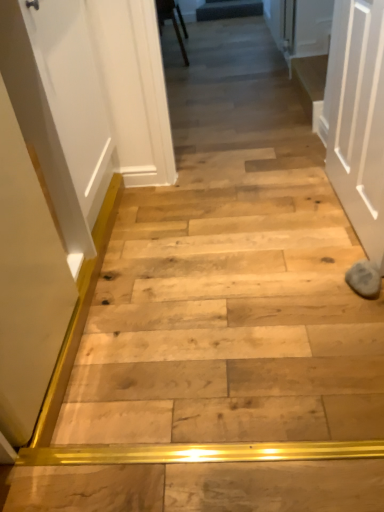
Question: Is point (236, 13) closer or farther from the camera than point (314, 111)?

Choices:
 (A) closer
 (B) farther

Answer: (B)

Question: From the image's perspective, is dark gray fabric at upper center, which is the second stairwell in front-to-back order, positioned above or below wooden step at center, which is the second stairwell in left-to-right order?

Choices:
 (A) below
 (B) above

Answer: (B)

Question: Estimate the real-world distances between objects in this image. Which object is farther from the wooden chair at upper center?

Choices:
 (A) dark gray fabric at upper center, which appears as the 1th stairwell when viewed from the left
 (B) white matte door at right
 (C) wooden step at center, the 1th stairwell from the right

Answer: (B)

Question: Which of these objects is positioned closest to the wooden step at center, which is the second stairwell in left-to-right order?

Choices:
 (A) wooden chair at upper center
 (B) dark gray fabric at upper center, which appears as the 1th stairwell when viewed from the top
 (C) white matte door at right

Answer: (C)